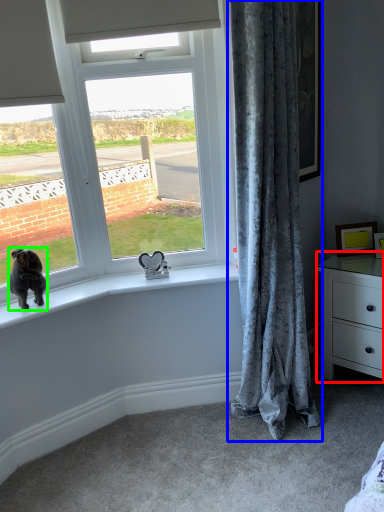
Question: Which is farther away from chest of drawers (highlighted by a red box)? curtain (highlighted by a blue box) or dog (highlighted by a green box)?

Choices:
 (A) curtain
 (B) dog

Answer: (B)